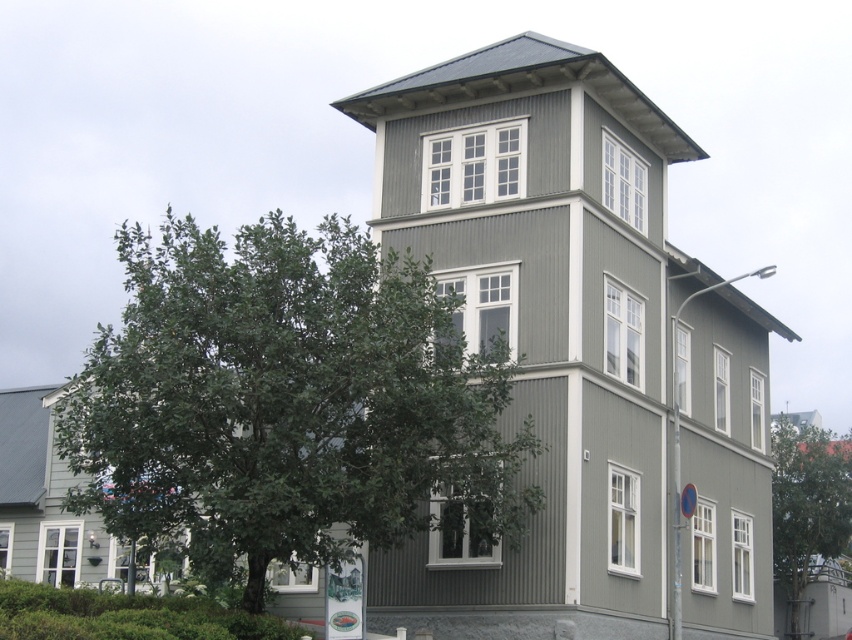
Which of these two, green leafy tree at left or green leafy tree at lower right, stands shorter?

With less height is green leafy tree at lower right.

At what (x,y) coordinates should I click in order to perform the action: click on green leafy tree at left. Please return your answer as a coordinate pair (x, y). Looking at the image, I should click on (286, 403).

The width and height of the screenshot is (852, 640). What do you see at coordinates (579, 349) in the screenshot? I see `matte gray siding at center` at bounding box center [579, 349].

Is matte gray siding at center thinner than green leafy tree at left?

No.

Which is behind, point (597, 556) or point (476, 497)?

Positioned behind is point (597, 556).

Find the location of `matte gray siding at center`. matte gray siding at center is located at coordinates (579, 349).

Between point (436, 177) and point (772, 528), which one is positioned behind?

The point (772, 528) is behind.

Is matte gray siding at center taller than green leafy tree at lower right?

Yes.

In order to click on matte gray siding at center in this screenshot , I will do `click(579, 349)`.